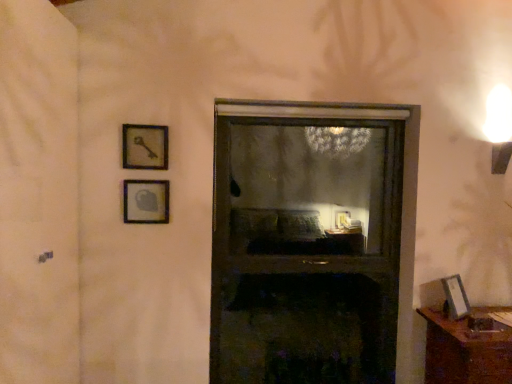
Identify the location of matte silver picture frame at lower right, which is the third picture frame from top to bottom. (455, 297).

This screenshot has height=384, width=512. Describe the element at coordinates (38, 195) in the screenshot. I see `transparent plastic screen door at left` at that location.

You are a GUI agent. You are given a task and a screenshot of the screen. Output one action in this format:
    pyautogui.click(x=<x>, y=<y>)
    Task: Click on the wooden key at upper left, marked as the second picture frame in a right-to-left arrangement
    Image resolution: width=512 pixels, height=384 pixels.
    Given the screenshot: What is the action you would take?
    pyautogui.click(x=144, y=147)

What do you see at coordinates (144, 147) in the screenshot? I see `wooden key at upper left, marked as the second picture frame in a left-to-right arrangement` at bounding box center [144, 147].

Where is `brown wooden table at lower right`? brown wooden table at lower right is located at coordinates 465,351.

Is brown wooden table at lower right directly adjacent to matte glass picture frame at upper left, acting as the third picture frame starting from the right?

No, brown wooden table at lower right is not beside matte glass picture frame at upper left, acting as the third picture frame starting from the right.

Can you confirm if brown wooden table at lower right is smaller than matte glass picture frame at upper left, the second picture frame from the top?

Actually, brown wooden table at lower right might be larger than matte glass picture frame at upper left, the second picture frame from the top.

From the image's perspective, is brown wooden table at lower right located beneath matte glass picture frame at upper left, acting as the third picture frame starting from the right?

Yes, from the image's perspective, brown wooden table at lower right is beneath matte glass picture frame at upper left, acting as the third picture frame starting from the right.

Does brown wooden table at lower right come in front of matte glass picture frame at upper left, the second picture frame from the top?

Yes, brown wooden table at lower right is closer to the viewer.

Does transparent glass window at center turn towards transparent plastic screen door at left?

No, transparent glass window at center is not aimed at transparent plastic screen door at left.

How far apart are transparent glass window at center and transparent plastic screen door at left?

transparent glass window at center and transparent plastic screen door at left are 3.77 feet apart.

From the image's perspective, between transparent glass window at center and transparent plastic screen door at left, which one is located above?

transparent plastic screen door at left appears higher in the image.

In the scene shown: Which object is thinner, transparent glass window at center or transparent plastic screen door at left?

With smaller width is transparent glass window at center.

In terms of height, does transparent plastic screen door at left look taller or shorter compared to matte silver picture frame at lower right, which is the third picture frame from top to bottom?

Considering their sizes, transparent plastic screen door at left has more height than matte silver picture frame at lower right, which is the third picture frame from top to bottom.

Does transparent plastic screen door at left come in front of matte silver picture frame at lower right, marked as the 1th picture frame in a right-to-left arrangement?

Yes, transparent plastic screen door at left is closer to the viewer.

Does brown wooden table at lower right have a lesser width compared to transparent glass window at center?

In fact, brown wooden table at lower right might be wider than transparent glass window at center.

Who is bigger, brown wooden table at lower right or transparent glass window at center?

transparent glass window at center is bigger.

How distant is brown wooden table at lower right from transparent glass window at center?

brown wooden table at lower right is 26.25 inches from transparent glass window at center.

Considering the sizes of brown wooden table at lower right and transparent glass window at center in the image, is brown wooden table at lower right taller or shorter than transparent glass window at center?

Considering their sizes, brown wooden table at lower right has less height than transparent glass window at center.

Can you confirm if transparent glass window at center is thinner than matte glass picture frame at upper left, the second picture frame from the top?

No.

In the scene shown: Considering the relative sizes of transparent glass window at center and matte glass picture frame at upper left, which appears as the 2th picture frame when ordered from the bottom, in the image provided, is transparent glass window at center taller than matte glass picture frame at upper left, which appears as the 2th picture frame when ordered from the bottom,?

Yes.

Can we say transparent glass window at center lies outside matte glass picture frame at upper left, acting as the third picture frame starting from the right?

Yes, transparent glass window at center is not within matte glass picture frame at upper left, acting as the third picture frame starting from the right.

In the image, is matte silver picture frame at lower right, which ranks as the 3th picture frame in left-to-right order, on the left side or the right side of brown wooden table at lower right?

In the image, matte silver picture frame at lower right, which ranks as the 3th picture frame in left-to-right order, appears on the left side of brown wooden table at lower right.

Is matte silver picture frame at lower right, which ranks as the 3th picture frame in left-to-right order, next to brown wooden table at lower right?

No, matte silver picture frame at lower right, which ranks as the 3th picture frame in left-to-right order, is not in contact with brown wooden table at lower right.

Based on the photo, from a real-world perspective, is matte silver picture frame at lower right, acting as the first picture frame starting from the bottom, below brown wooden table at lower right?

No, from a real-world perspective, matte silver picture frame at lower right, acting as the first picture frame starting from the bottom, is not beneath brown wooden table at lower right.

Considering the sizes of matte silver picture frame at lower right, acting as the first picture frame starting from the bottom, and brown wooden table at lower right in the image, is matte silver picture frame at lower right, acting as the first picture frame starting from the bottom, bigger or smaller than brown wooden table at lower right?

matte silver picture frame at lower right, acting as the first picture frame starting from the bottom, is smaller than brown wooden table at lower right.

Which point is more distant from viewer, [152,217] or [467,298]?

The point [467,298] is more distant.

Considering the relative positions of matte glass picture frame at upper left, which is counted as the 1th picture frame, starting from the left, and matte silver picture frame at lower right, acting as the first picture frame starting from the bottom, in the image provided, is matte glass picture frame at upper left, which is counted as the 1th picture frame, starting from the left, to the right of matte silver picture frame at lower right, acting as the first picture frame starting from the bottom, from the viewer's perspective?

Incorrect, matte glass picture frame at upper left, which is counted as the 1th picture frame, starting from the left, is not on the right side of matte silver picture frame at lower right, acting as the first picture frame starting from the bottom.

Consider the image. From a real-world perspective, which object stands above the other?

matte glass picture frame at upper left, the second picture frame from the top, from a real-world perspective.

From the image's perspective, count 2nd picture frames upward from the brown wooden table at lower right and point to it. Please provide its 2D coordinates.

[(146, 201)]

Where is `window below the transparent plastic screen door at left (from a real-world perspective)`? window below the transparent plastic screen door at left (from a real-world perspective) is located at coordinates (312, 242).

From the image, which object appears to be nearer to wooden key at upper left, which is the first picture frame from top to bottom, brown wooden table at lower right or matte silver picture frame at lower right, marked as the 1th picture frame in a right-to-left arrangement?

brown wooden table at lower right.

Estimate the real-world distances between objects in this image. Which object is further from brown wooden table at lower right, matte silver picture frame at lower right, acting as the first picture frame starting from the bottom, or wooden key at upper left, arranged as the third picture frame when ordered from the bottom?

wooden key at upper left, arranged as the third picture frame when ordered from the bottom, is further to brown wooden table at lower right.

Based on their spatial positions, is brown wooden table at lower right or transparent plastic screen door at left further from transparent glass window at center?

transparent plastic screen door at left.

Which object lies further to the anchor point wooden key at upper left, marked as the second picture frame in a left-to-right arrangement, brown wooden table at lower right or transparent plastic screen door at left?

brown wooden table at lower right is further to wooden key at upper left, marked as the second picture frame in a left-to-right arrangement.

Based on their spatial positions, is matte silver picture frame at lower right, acting as the first picture frame starting from the bottom, or transparent plastic screen door at left further from wooden key at upper left, which is the first picture frame from top to bottom?

The object further to wooden key at upper left, which is the first picture frame from top to bottom, is matte silver picture frame at lower right, acting as the first picture frame starting from the bottom.

Estimate the real-world distances between objects in this image. Which object is closer to matte glass picture frame at upper left, the second picture frame from the top, brown wooden table at lower right or transparent plastic screen door at left?

The object closer to matte glass picture frame at upper left, the second picture frame from the top, is transparent plastic screen door at left.

Considering their positions, is matte glass picture frame at upper left, acting as the third picture frame starting from the right, positioned closer to wooden key at upper left, which is the first picture frame from top to bottom, than transparent plastic screen door at left?

The object closer to wooden key at upper left, which is the first picture frame from top to bottom, is matte glass picture frame at upper left, acting as the third picture frame starting from the right.

Considering their positions, is wooden key at upper left, marked as the second picture frame in a right-to-left arrangement, positioned further to transparent plastic screen door at left than matte glass picture frame at upper left, which appears as the 2th picture frame when ordered from the bottom?

Among the two, wooden key at upper left, marked as the second picture frame in a right-to-left arrangement, is located further to transparent plastic screen door at left.

The width and height of the screenshot is (512, 384). Identify the location of picture frame between matte glass picture frame at upper left, acting as the third picture frame starting from the right, and transparent glass window at center from left to right. (144, 147).

You are a GUI agent. You are given a task and a screenshot of the screen. Output one action in this format:
    pyautogui.click(x=<x>, y=<y>)
    Task: Click on the picture frame located between transparent glass window at center and brown wooden table at lower right in the left-right direction
    
    Given the screenshot: What is the action you would take?
    pyautogui.click(x=455, y=297)

I want to click on window between transparent plastic screen door at left and brown wooden table at lower right, so click(x=312, y=242).

You are a GUI agent. You are given a task and a screenshot of the screen. Output one action in this format:
    pyautogui.click(x=<x>, y=<y>)
    Task: Click on the picture frame between matte glass picture frame at upper left, which appears as the 2th picture frame when ordered from the bottom, and matte silver picture frame at lower right, which ranks as the 3th picture frame in left-to-right order, in the horizontal direction
    This screenshot has width=512, height=384.
    Given the screenshot: What is the action you would take?
    pyautogui.click(x=144, y=147)